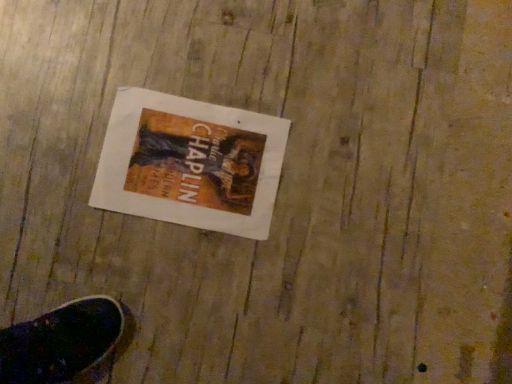
Locate an element on the screen. free space above white paper flyer at center (from a real-world perspective) is located at coordinates (186, 161).